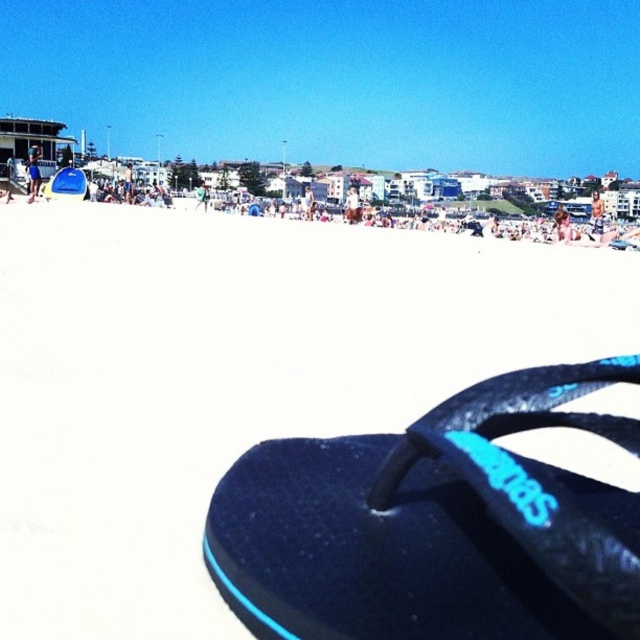
You are standing at the point labeled point (518, 307) and want to walk to the waterline. The beach has two paths available. Path A is 10 feet long and goes directly towards the water. Path B is 9 feet long and curves around a sand dune. Which path should you take to reach the water faster?

Path B is shorter at 9 feet compared to Path A which is 10 feet long, so taking Path B would get you to the water faster.

You are standing on the beach and see the white sand at lower center and the black rubber sandal at lower right. Which object is closer to your right side?

The black rubber sandal at lower right is closer to your right side because it is positioned to the right of the white sand at lower center.